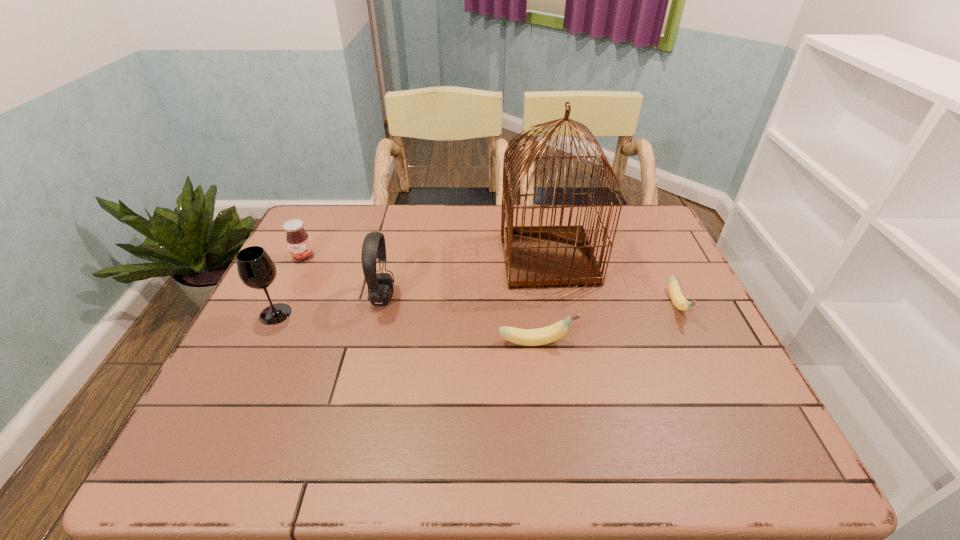
Image resolution: width=960 pixels, height=540 pixels. Identify the location of free region located 0.050m on the label side of the jam. (295, 274).

Find the location of a particular element. vacant space situated on the left of the tallest object is located at coordinates (372, 259).

Where is `free region located on the front-facing side of the headset`? free region located on the front-facing side of the headset is located at coordinates (444, 298).

I want to click on free space located 0.330m on the back of the wineglass, so click(x=316, y=230).

This screenshot has width=960, height=540. In order to click on object that is positioned at the far edge in this screenshot , I will do `click(539, 256)`.

The image size is (960, 540). I want to click on jam located at the left edge, so click(298, 241).

I want to click on wineglass that is positioned at the left edge, so [256, 269].

Where is `object at the right edge`? object at the right edge is located at coordinates (679, 301).

Locate an element on the screen. The image size is (960, 540). free point at the far edge is located at coordinates (390, 239).

In the image, there is a desktop. Where is `blank space at the near edge`? blank space at the near edge is located at coordinates (659, 393).